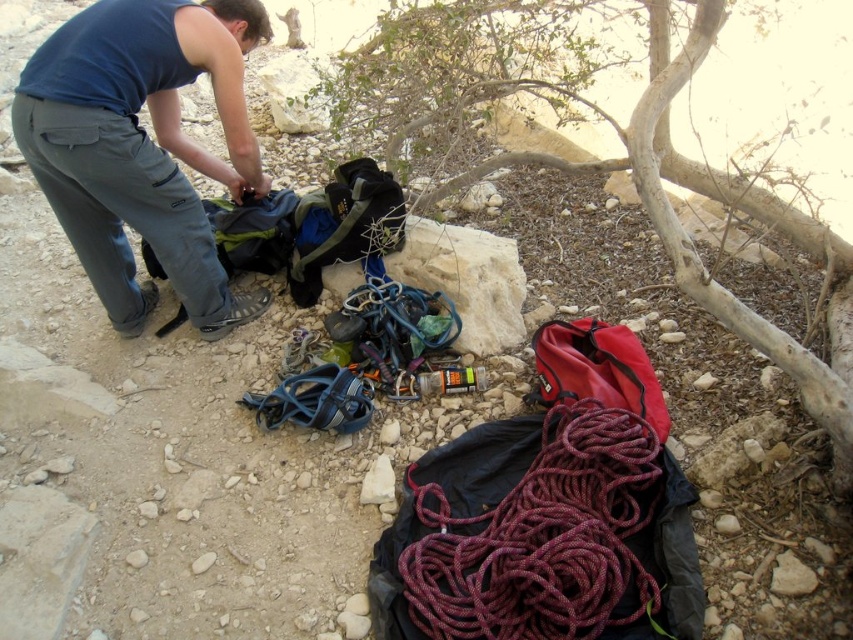
Is blue fabric pants at left below maroon braided rope at center?

No, blue fabric pants at left is not below maroon braided rope at center.

Does blue fabric pants at left have a larger size compared to maroon braided rope at center?

Yes, blue fabric pants at left is bigger than maroon braided rope at center.

Which is in front, point (263, 10) or point (635, 592)?

Point (635, 592)

Locate an element on the screen. The image size is (853, 640). blue fabric pants at left is located at coordinates (142, 147).